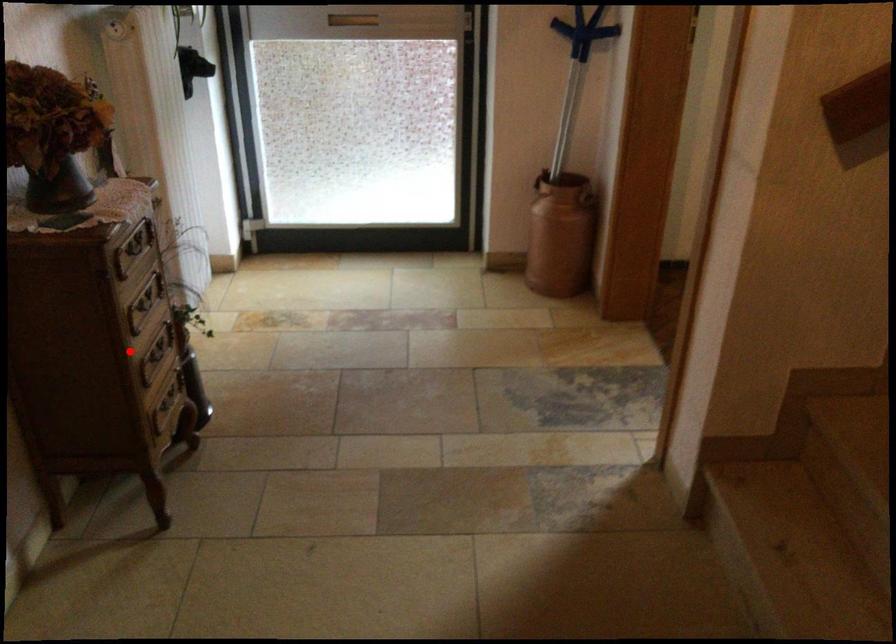
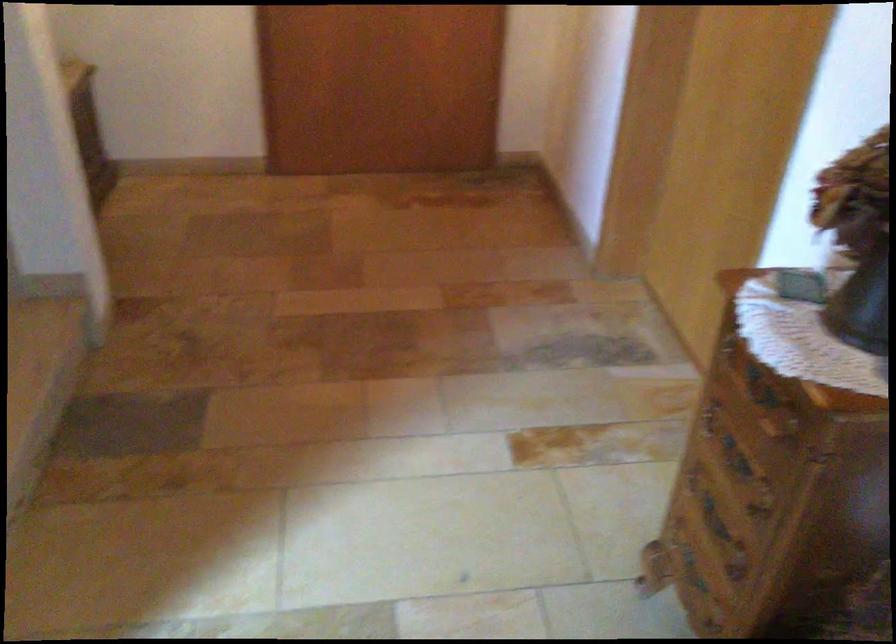
Question: A red point is marked in image1. In image2, is the corresponding 3D point closer to the camera or farther? Reply with the corresponding letter.

Choices:
 (A) The corresponding 3D point is closer.
 (B) The corresponding 3D point is farther.

Answer: (A)